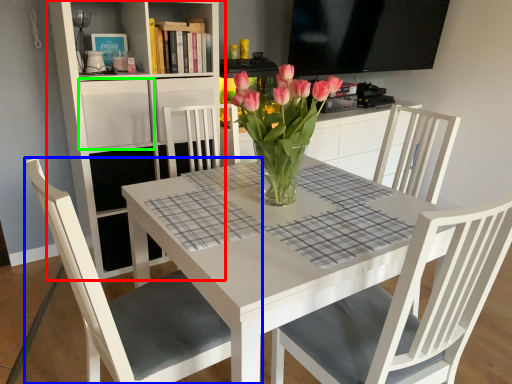
Question: Based on their relative distances, which object is nearer to shelf (highlighted by a red box)? Choose from chair (highlighted by a blue box) and shelf (highlighted by a green box).

Choices:
 (A) chair
 (B) shelf

Answer: (B)